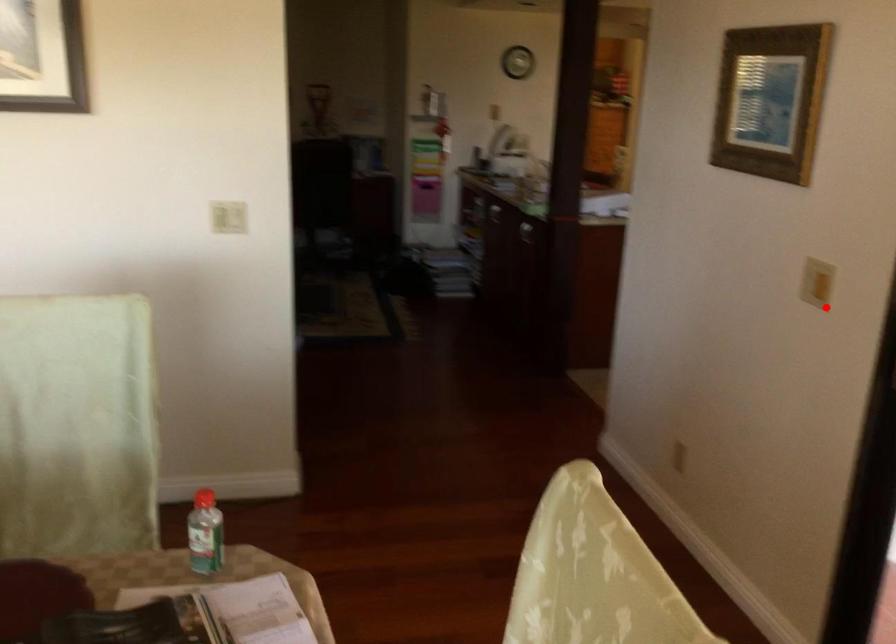
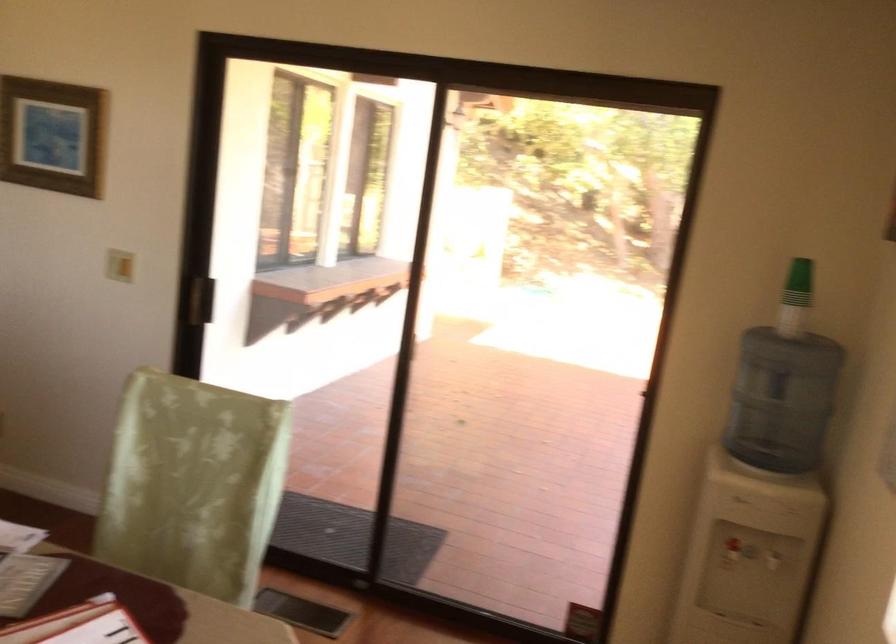
The point at the highlighted location is marked in the first image. Where is the corresponding point in the second image?

(119, 265)